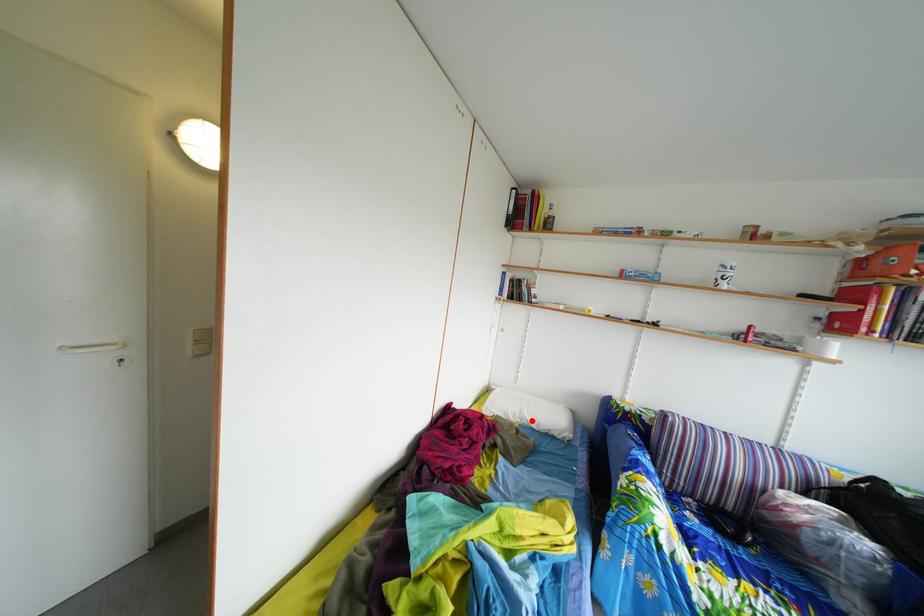
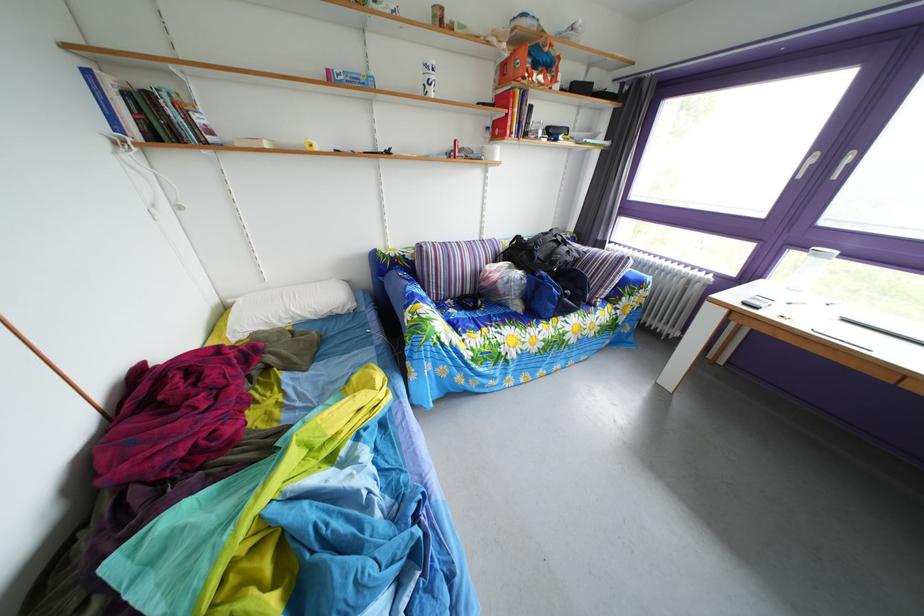
Question: I am providing you with two images of the same scene from different viewpoints. A red point is marked on the first image. Can you still see the location of the red point in image 2?

Choices:
 (A) Yes
 (B) No

Answer: (A)